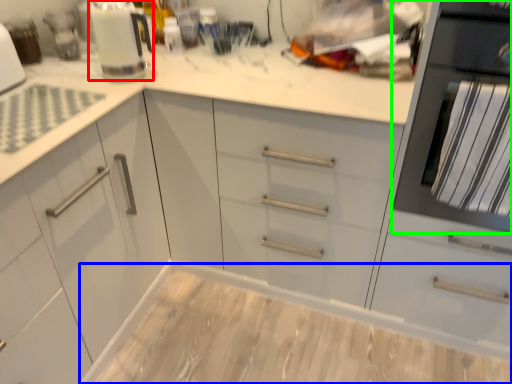
Question: Which object is positioned farthest from kitchen appliance (highlighted by a red box)? Select from counter (highlighted by a blue box) and home appliance (highlighted by a green box).

Choices:
 (A) counter
 (B) home appliance

Answer: (A)